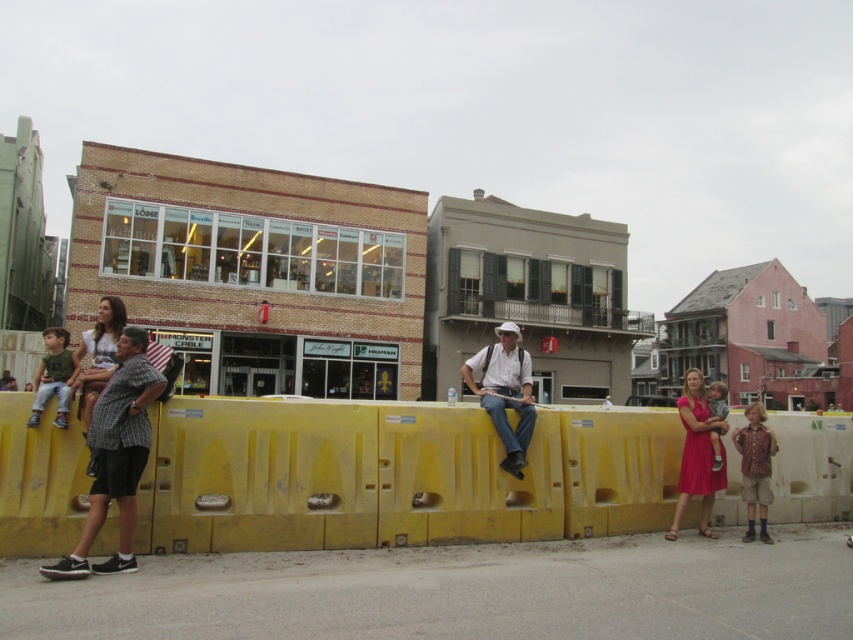
Which is more to the right, matte pink dress at center or light gray cotton shirt at center?

light gray cotton shirt at center

Who is more forward, (703, 424) or (720, 412)?

Point (703, 424) is more forward.

The height and width of the screenshot is (640, 853). Find the location of `matte pink dress at center`. matte pink dress at center is located at coordinates pos(697,452).

Can you confirm if yellow plastic barrier at center is thinner than matte pink dress at center?

Yes.

Who is lower down, yellow plastic barrier at center or matte pink dress at center?

Positioned lower is yellow plastic barrier at center.

Locate an element on the screen. The width and height of the screenshot is (853, 640). yellow plastic barrier at center is located at coordinates (395, 476).

Does checkered fabric shirt at left have a lesser width compared to green cotton shirt at left?

Yes.

Does checkered fabric shirt at left have a smaller size compared to green cotton shirt at left?

Indeed, checkered fabric shirt at left has a smaller size compared to green cotton shirt at left.

The width and height of the screenshot is (853, 640). I want to click on checkered fabric shirt at left, so click(115, 456).

Where is `checkered fabric shirt at left`? This screenshot has width=853, height=640. checkered fabric shirt at left is located at coordinates (115, 456).